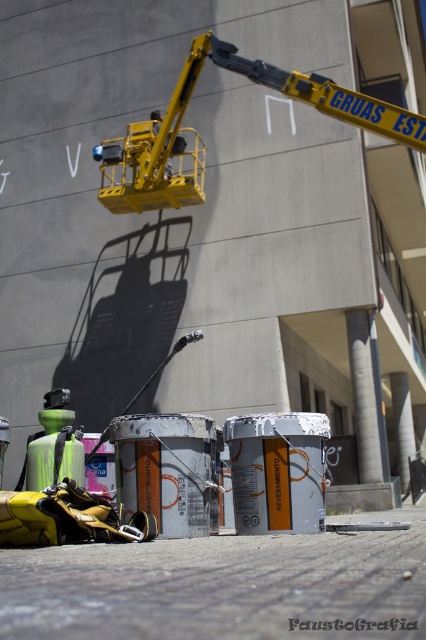
Question: Does yellow metallic crane at upper center have a lesser width compared to yellow metallic crane arm at upper center?

Choices:
 (A) yes
 (B) no

Answer: (B)

Question: Observing the image, what is the correct spatial positioning of yellow metallic crane at upper center in reference to yellow metallic crane arm at upper center?

Choices:
 (A) left
 (B) right

Answer: (B)

Question: Among these points, which one is nearest to the camera?

Choices:
 (A) (169, 172)
 (B) (123, 198)

Answer: (B)

Question: Among these objects, which one is farthest from the camera?

Choices:
 (A) yellow metallic crane at upper center
 (B) yellow metallic crane arm at upper center

Answer: (B)

Question: Which point is farther from the camera taking this photo?

Choices:
 (A) (135, 161)
 (B) (161, 120)

Answer: (B)

Question: Does yellow metallic crane at upper center appear under yellow metallic crane arm at upper center?

Choices:
 (A) no
 (B) yes

Answer: (B)